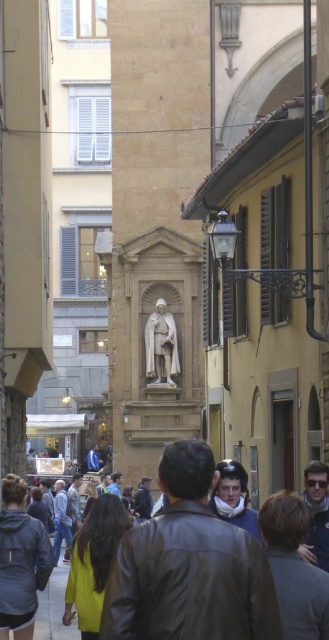
Can you confirm if yellow fabric hair at center is positioned to the left of denim jeans at center?

In fact, yellow fabric hair at center is to the right of denim jeans at center.

Can you confirm if yellow fabric hair at center is bigger than denim jeans at center?

No, yellow fabric hair at center is not bigger than denim jeans at center.

Is point (101, 548) closer to viewer compared to point (55, 532)?

That is True.

At what (x,y) coordinates should I click in order to perform the action: click on yellow fabric hair at center. Please return your answer as a coordinate pair (x, y). Looking at the image, I should click on (94, 563).

Can you confirm if white marble statue at center is taller than blue denim jacket at center?

No.

Is point (151, 358) in front of point (117, 472)?

That is True.

The image size is (329, 640). Find the location of `white marble statue at center`. white marble statue at center is located at coordinates (160, 346).

Who is lower down, dark gray leather jacket at lower right or camouflage jacket at center?

camouflage jacket at center is lower down.

Can you confirm if dark gray leather jacket at lower right is positioned to the left of camouflage jacket at center?

Incorrect, dark gray leather jacket at lower right is not on the left side of camouflage jacket at center.

At what (x,y) coordinates should I click in order to perform the action: click on dark gray leather jacket at lower right. Please return your answer as a coordinate pair (x, y). Looking at the image, I should click on (294, 568).